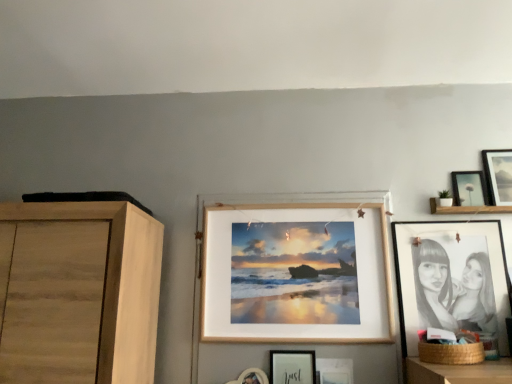
In order to face wooden frame at center, positioned as the 5th picture frame in right-to-left order, should I rotate leftwards or rightwards?

Rotate right and turn 4.766 degrees.

I want to click on black paper portrait at right, acting as the fourth picture frame starting from the left, so click(451, 278).

What is the approximate height of matte black picture frame at upper right, arranged as the 1th picture frame when viewed from the right?

matte black picture frame at upper right, arranged as the 1th picture frame when viewed from the right, is 10.23 inches in height.

The image size is (512, 384). What are the coordinates of `matte black picture frame at upper right, arranged as the 1th picture frame when viewed from the right` in the screenshot? It's located at (498, 176).

Where is `matte wooden picture frame at center, marked as the fourth picture frame in a right-to-left arrangement`? The image size is (512, 384). matte wooden picture frame at center, marked as the fourth picture frame in a right-to-left arrangement is located at coordinates (334, 371).

Identify the location of matte white picture frame at center, acting as the 1th picture frame starting from the left. (292, 367).

Are matte white picture frame at center, which is the 6th picture frame from right to left, and matte black picture frame at upper right, placed as the 6th picture frame when sorted from left to right, beside each other?

matte white picture frame at center, which is the 6th picture frame from right to left, and matte black picture frame at upper right, placed as the 6th picture frame when sorted from left to right, are clearly separated.

Considering the points (305, 364) and (504, 190), which point is in front, point (305, 364) or point (504, 190)?

The point (305, 364) is more forward.

Is matte white picture frame at center, acting as the 1th picture frame starting from the left, oriented away from matte black picture frame at upper right, placed as the 6th picture frame when sorted from left to right?

No, matte white picture frame at center, acting as the 1th picture frame starting from the left, is not facing the opposite direction of matte black picture frame at upper right, placed as the 6th picture frame when sorted from left to right.

Where is `picture frame that is the 1st object located above the matte wooden picture frame at center, marked as the fourth picture frame in a right-to-left arrangement (from the image's perspective)`? Image resolution: width=512 pixels, height=384 pixels. picture frame that is the 1st object located above the matte wooden picture frame at center, marked as the fourth picture frame in a right-to-left arrangement (from the image's perspective) is located at coordinates (292, 367).

Is matte white picture frame at center, which is the 6th picture frame from right to left, surrounded by matte wooden picture frame at center, marked as the fourth picture frame in a right-to-left arrangement?

No, matte white picture frame at center, which is the 6th picture frame from right to left, is located outside of matte wooden picture frame at center, marked as the fourth picture frame in a right-to-left arrangement.

Which of these two, matte wooden picture frame at center, acting as the third picture frame starting from the left, or matte white picture frame at center, which is the 6th picture frame from right to left, is wider?

matte white picture frame at center, which is the 6th picture frame from right to left.

Is point (352, 381) closer or farther from the camera than point (285, 375)?

Point (352, 381) appears to be farther away from the viewer than point (285, 375).

Is matte black picture frame at upper right, the 2th picture frame positioned from the right, at the back of matte black picture frame at upper right, placed as the 6th picture frame when sorted from left to right?

No.

Consider the image. Is matte black picture frame at upper right, arranged as the 1th picture frame when viewed from the right, wider than matte black picture frame at upper right, which is the fifth picture frame from left to right?

In fact, matte black picture frame at upper right, arranged as the 1th picture frame when viewed from the right, might be narrower than matte black picture frame at upper right, which is the fifth picture frame from left to right.

Would you say matte black picture frame at upper right, the 2th picture frame positioned from the right, is part of matte black picture frame at upper right, arranged as the 1th picture frame when viewed from the right,'s contents?

No, matte black picture frame at upper right, the 2th picture frame positioned from the right, is located outside of matte black picture frame at upper right, arranged as the 1th picture frame when viewed from the right.

Is matte black picture frame at upper right, arranged as the 1th picture frame when viewed from the right, closer to camera compared to matte black picture frame at upper right, which is the fifth picture frame from left to right?

Yes, matte black picture frame at upper right, arranged as the 1th picture frame when viewed from the right, is closer to the camera.

Can you tell me how much black paper portrait at right, acting as the fourth picture frame starting from the left, and matte wooden picture frame at center, acting as the third picture frame starting from the left, differ in facing direction?

0.61 degrees separate the facing orientations of black paper portrait at right, acting as the fourth picture frame starting from the left, and matte wooden picture frame at center, acting as the third picture frame starting from the left.

Is black paper portrait at right, marked as the 3th picture frame in a right-to-left arrangement, oriented away from matte wooden picture frame at center, acting as the third picture frame starting from the left?

No.

Is point (409, 346) closer to viewer compared to point (333, 374)?

No, (409, 346) is behind (333, 374).

Image resolution: width=512 pixels, height=384 pixels. I want to click on the 1st picture frame counting from the right side of the matte wooden picture frame at center, marked as the fourth picture frame in a right-to-left arrangement, so click(x=451, y=278).

The height and width of the screenshot is (384, 512). Find the location of `picture frame that is the 1st one when counting upward from the matte white picture frame at center, which is the 6th picture frame from right to left (from the image's perspective)`. picture frame that is the 1st one when counting upward from the matte white picture frame at center, which is the 6th picture frame from right to left (from the image's perspective) is located at coordinates (451, 278).

Considering the relative sizes of matte white picture frame at center, which is the 6th picture frame from right to left, and black paper portrait at right, marked as the 3th picture frame in a right-to-left arrangement, in the image provided, is matte white picture frame at center, which is the 6th picture frame from right to left, smaller than black paper portrait at right, marked as the 3th picture frame in a right-to-left arrangement,?

Correct, matte white picture frame at center, which is the 6th picture frame from right to left, occupies less space than black paper portrait at right, marked as the 3th picture frame in a right-to-left arrangement.

Considering the relative sizes of matte white picture frame at center, which is the 6th picture frame from right to left, and black paper portrait at right, marked as the 3th picture frame in a right-to-left arrangement, in the image provided, is matte white picture frame at center, which is the 6th picture frame from right to left, taller than black paper portrait at right, marked as the 3th picture frame in a right-to-left arrangement,?

No, matte white picture frame at center, which is the 6th picture frame from right to left, is not taller than black paper portrait at right, marked as the 3th picture frame in a right-to-left arrangement.

Which object is positioned more to the left, matte white picture frame at center, acting as the 1th picture frame starting from the left, or black paper portrait at right, acting as the fourth picture frame starting from the left?

From the viewer's perspective, matte white picture frame at center, acting as the 1th picture frame starting from the left, appears more on the left side.

In terms of height, does wooden frame at center, arranged as the 2th picture frame when viewed from the left, look taller or shorter compared to matte black picture frame at upper right, the 2th picture frame positioned from the right?

In the image, wooden frame at center, arranged as the 2th picture frame when viewed from the left, appears to be taller than matte black picture frame at upper right, the 2th picture frame positioned from the right.

Is matte black picture frame at upper right, the 2th picture frame positioned from the right, at the back of wooden frame at center, arranged as the 2th picture frame when viewed from the left?

wooden frame at center, arranged as the 2th picture frame when viewed from the left, does not have its back to matte black picture frame at upper right, the 2th picture frame positioned from the right.

Which is more to the right, wooden frame at center, arranged as the 2th picture frame when viewed from the left, or matte black picture frame at upper right, the 2th picture frame positioned from the right?

Positioned to the right is matte black picture frame at upper right, the 2th picture frame positioned from the right.

Which picture frame is the 3rd one when counting from the right side of the wooden frame at center, positioned as the 5th picture frame in right-to-left order? Please provide its 2D coordinates.

[(468, 188)]

You are a GUI agent. You are given a task and a screenshot of the screen. Output one action in this format:
    pyautogui.click(x=<x>, y=<y>)
    Task: Click on the 2nd picture frame above the black paper portrait at right, acting as the fourth picture frame starting from the left (from the image's perspective)
    The height and width of the screenshot is (384, 512).
    Given the screenshot: What is the action you would take?
    [468, 188]

Which of these two, matte black picture frame at upper right, the 2th picture frame positioned from the right, or black paper portrait at right, marked as the 3th picture frame in a right-to-left arrangement, is bigger?

With larger size is black paper portrait at right, marked as the 3th picture frame in a right-to-left arrangement.

Does matte black picture frame at upper right, the 2th picture frame positioned from the right, come behind black paper portrait at right, marked as the 3th picture frame in a right-to-left arrangement?

Yes.

Considering the relative sizes of matte black picture frame at upper right, which is the fifth picture frame from left to right, and black paper portrait at right, marked as the 3th picture frame in a right-to-left arrangement, in the image provided, is matte black picture frame at upper right, which is the fifth picture frame from left to right, shorter than black paper portrait at right, marked as the 3th picture frame in a right-to-left arrangement,?

Indeed, matte black picture frame at upper right, which is the fifth picture frame from left to right, has a lesser height compared to black paper portrait at right, marked as the 3th picture frame in a right-to-left arrangement.

Locate an element on the screen. Image resolution: width=512 pixels, height=384 pixels. picture frame that is the 5th one when counting rightward from the matte white picture frame at center, acting as the 1th picture frame starting from the left is located at coordinates (498, 176).

From the matte wooden picture frame at center, marked as the fourth picture frame in a right-to-left arrangement, count 1st picture frames backward and point to it. Please provide its 2D coordinates.

[(292, 367)]

When comparing their distances from matte wooden picture frame at center, acting as the third picture frame starting from the left, does matte white picture frame at center, acting as the 1th picture frame starting from the left, or matte black picture frame at upper right, which is the fifth picture frame from left to right, seem further?

Based on the image, matte black picture frame at upper right, which is the fifth picture frame from left to right, appears to be further to matte wooden picture frame at center, acting as the third picture frame starting from the left.

Which object lies further to the anchor point black paper portrait at right, acting as the fourth picture frame starting from the left, brown woven basket at lower right or wooden frame at center, positioned as the 5th picture frame in right-to-left order?

The object further to black paper portrait at right, acting as the fourth picture frame starting from the left, is wooden frame at center, positioned as the 5th picture frame in right-to-left order.

Consider the image. Considering their positions, is matte wooden picture frame at center, marked as the fourth picture frame in a right-to-left arrangement, positioned further to black paper portrait at right, acting as the fourth picture frame starting from the left, than matte black picture frame at upper right, which is the fifth picture frame from left to right?

matte wooden picture frame at center, marked as the fourth picture frame in a right-to-left arrangement, lies further to black paper portrait at right, acting as the fourth picture frame starting from the left, than the other object.

In the scene shown: Based on their spatial positions, is black paper portrait at right, marked as the 3th picture frame in a right-to-left arrangement, or wooden frame at center, arranged as the 2th picture frame when viewed from the left, further from matte white picture frame at center, which is the 6th picture frame from right to left?

black paper portrait at right, marked as the 3th picture frame in a right-to-left arrangement, is positioned further to the anchor matte white picture frame at center, which is the 6th picture frame from right to left.

From the image, which object appears to be nearer to matte black picture frame at upper right, which is the fifth picture frame from left to right, black paper portrait at right, marked as the 3th picture frame in a right-to-left arrangement, or wooden frame at center, positioned as the 5th picture frame in right-to-left order?

black paper portrait at right, marked as the 3th picture frame in a right-to-left arrangement, is positioned closer to the anchor matte black picture frame at upper right, which is the fifth picture frame from left to right.

When comparing their distances from wooden frame at center, positioned as the 5th picture frame in right-to-left order, does matte black picture frame at upper right, the 2th picture frame positioned from the right, or matte wooden picture frame at center, marked as the fourth picture frame in a right-to-left arrangement, seem further?

The object further to wooden frame at center, positioned as the 5th picture frame in right-to-left order, is matte black picture frame at upper right, the 2th picture frame positioned from the right.

Estimate the real-world distances between objects in this image. Which object is further from matte black picture frame at upper right, the 2th picture frame positioned from the right, matte white picture frame at center, which is the 6th picture frame from right to left, or wooden frame at center, positioned as the 5th picture frame in right-to-left order?

Based on the image, matte white picture frame at center, which is the 6th picture frame from right to left, appears to be further to matte black picture frame at upper right, the 2th picture frame positioned from the right.

Looking at the image, which one is located closer to matte black picture frame at upper right, which is the fifth picture frame from left to right, black paper portrait at right, marked as the 3th picture frame in a right-to-left arrangement, or brown woven basket at lower right?

black paper portrait at right, marked as the 3th picture frame in a right-to-left arrangement, lies closer to matte black picture frame at upper right, which is the fifth picture frame from left to right, than the other object.

Where is `basket between matte black picture frame at upper right, the 2th picture frame positioned from the right, and matte wooden picture frame at center, acting as the third picture frame starting from the left, vertically`? This screenshot has width=512, height=384. basket between matte black picture frame at upper right, the 2th picture frame positioned from the right, and matte wooden picture frame at center, acting as the third picture frame starting from the left, vertically is located at coordinates (451, 353).

Image resolution: width=512 pixels, height=384 pixels. I want to click on picture frame located between wooden frame at center, positioned as the 5th picture frame in right-to-left order, and black paper portrait at right, marked as the 3th picture frame in a right-to-left arrangement, in the left-right direction, so click(334, 371).

The height and width of the screenshot is (384, 512). Identify the location of basket between matte black picture frame at upper right, placed as the 6th picture frame when sorted from left to right, and matte wooden picture frame at center, marked as the fourth picture frame in a right-to-left arrangement, vertically. (451, 353).

What are the coordinates of `basket located between wooden frame at center, positioned as the 5th picture frame in right-to-left order, and black paper portrait at right, marked as the 3th picture frame in a right-to-left arrangement, in the left-right direction` in the screenshot? It's located at (451, 353).